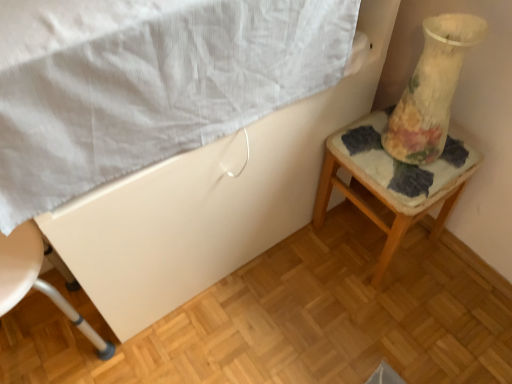
Question: Is floral fabric cushion at right to the right of white textured sheet at upper left from the viewer's perspective?

Choices:
 (A) yes
 (B) no

Answer: (A)

Question: Does floral fabric cushion at right have a greater height compared to white textured sheet at upper left?

Choices:
 (A) no
 (B) yes

Answer: (B)

Question: Is floral fabric cushion at right shorter than white textured sheet at upper left?

Choices:
 (A) yes
 (B) no

Answer: (B)

Question: From a real-world perspective, is floral fabric cushion at right positioned under white textured sheet at upper left based on gravity?

Choices:
 (A) yes
 (B) no

Answer: (A)

Question: From the image's perspective, is floral fabric cushion at right below white textured sheet at upper left?

Choices:
 (A) no
 (B) yes

Answer: (B)

Question: From the image's perspective, is floral fabric cushion at right over white textured sheet at upper left?

Choices:
 (A) yes
 (B) no

Answer: (B)

Question: Does floral fabric cushion at right appear on the left side of white plastic chair at lower left?

Choices:
 (A) no
 (B) yes

Answer: (A)

Question: Is floral fabric cushion at right far away from white plastic chair at lower left?

Choices:
 (A) yes
 (B) no

Answer: (B)

Question: Does floral fabric cushion at right have a smaller size compared to white plastic chair at lower left?

Choices:
 (A) no
 (B) yes

Answer: (A)

Question: Can you confirm if floral fabric cushion at right is thinner than white plastic chair at lower left?

Choices:
 (A) yes
 (B) no

Answer: (B)

Question: From the image's perspective, is floral fabric cushion at right on top of white plastic chair at lower left?

Choices:
 (A) no
 (B) yes

Answer: (B)

Question: Is white plastic chair at lower left surrounded by floral fabric cushion at right?

Choices:
 (A) yes
 (B) no

Answer: (B)

Question: Considering the relative sizes of floral-patterned glass at right and white textured sheet at upper left in the image provided, is floral-patterned glass at right shorter than white textured sheet at upper left?

Choices:
 (A) no
 (B) yes

Answer: (A)